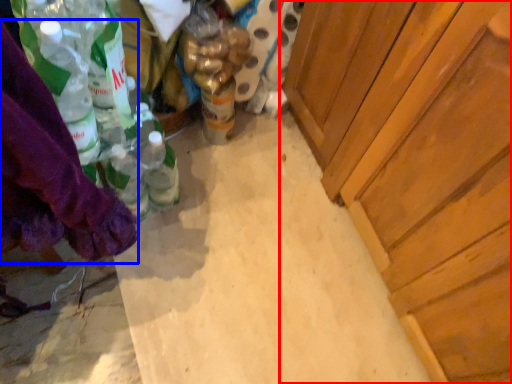
Question: Which of the following is the closest to the observer, cabinetry (highlighted by a red box) or clothing (highlighted by a blue box)?

Choices:
 (A) cabinetry
 (B) clothing

Answer: (B)